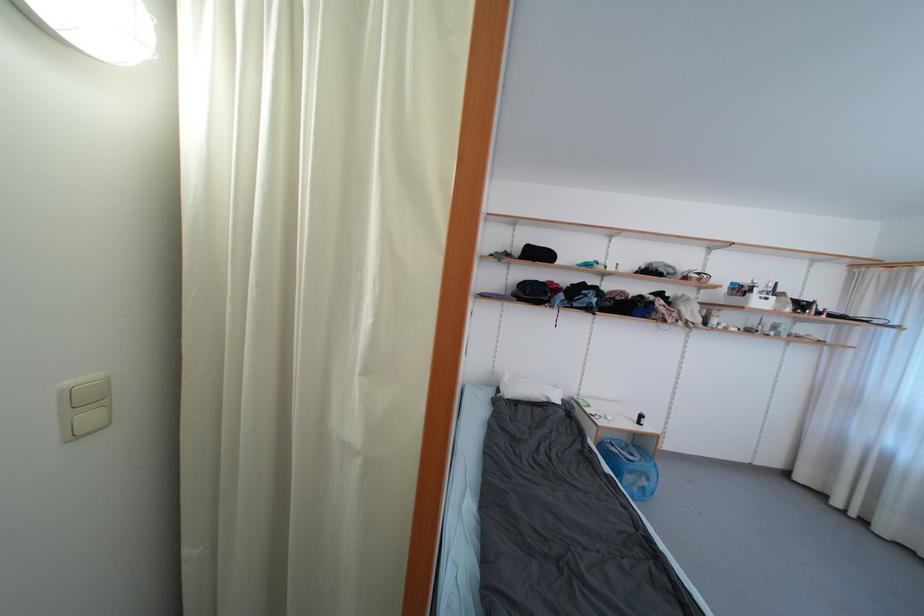
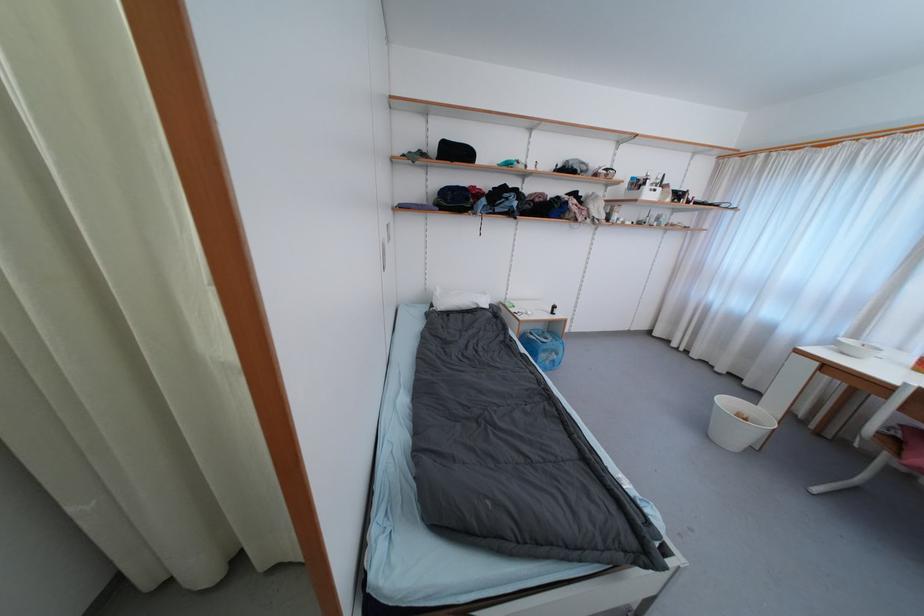
Question: The first image is from the beginning of the video and the second image is from the end. How did the camera likely rotate when shooting the video?

Choices:
 (A) Left
 (B) Right
 (C) Up
 (D) Down

Answer: (D)